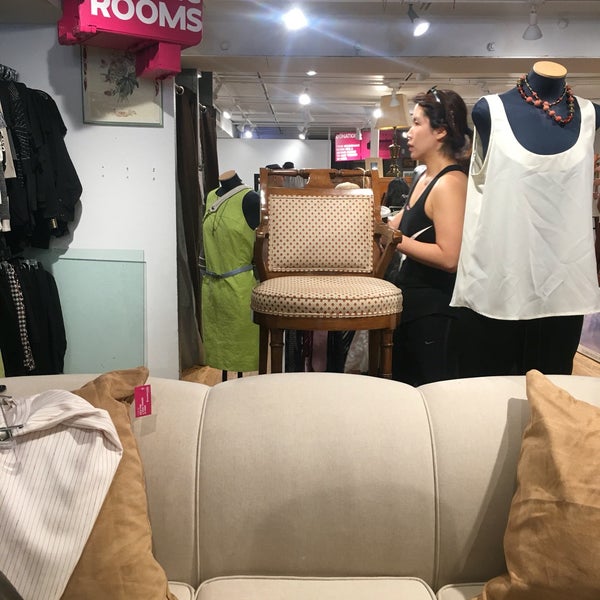
I want to click on sofa, so click(321, 452).